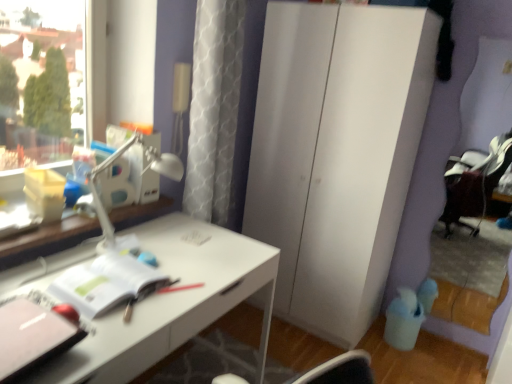
Question: Can you see pink matte notebook at lower left, marked as the 2th notebook in a back-to-front arrangement, touching white matte notebook at center, which is counted as the second notebook, starting from the front?

Choices:
 (A) no
 (B) yes

Answer: (A)

Question: Can you confirm if pink matte notebook at lower left, the 1th notebook in the front-to-back sequence, is positioned to the left of white matte notebook at center, the 1th notebook when ordered from back to front?

Choices:
 (A) no
 (B) yes

Answer: (B)

Question: Is the depth of pink matte notebook at lower left, marked as the 2th notebook in a back-to-front arrangement, greater than that of white matte notebook at center, the 1th notebook when ordered from back to front?

Choices:
 (A) yes
 (B) no

Answer: (B)

Question: Could you tell me if pink matte notebook at lower left, the 1th notebook in the front-to-back sequence, is turned towards white matte notebook at center, the 1th notebook when ordered from back to front?

Choices:
 (A) no
 (B) yes

Answer: (A)

Question: From a real-world perspective, is pink matte notebook at lower left, the 1th notebook in the front-to-back sequence, located beneath white matte notebook at center, the 1th notebook when ordered from back to front?

Choices:
 (A) no
 (B) yes

Answer: (A)

Question: Would you say white plastic table lamp at upper left is to the left or to the right of white matte notebook at center, which is counted as the second notebook, starting from the front, in the picture?

Choices:
 (A) right
 (B) left

Answer: (A)

Question: Is white plastic table lamp at upper left spatially inside white matte notebook at center, the 1th notebook when ordered from back to front, or outside of it?

Choices:
 (A) outside
 (B) inside

Answer: (A)

Question: Is white plastic table lamp at upper left in front of or behind white matte notebook at center, which is counted as the second notebook, starting from the front, in the image?

Choices:
 (A) behind
 (B) front

Answer: (A)

Question: Is point (151, 152) positioned closer to the camera than point (118, 266)?

Choices:
 (A) closer
 (B) farther

Answer: (B)

Question: From a real-world perspective, is white plastic table lamp at upper left positioned above or below white glossy desk at center?

Choices:
 (A) below
 (B) above

Answer: (B)

Question: Is white plastic table lamp at upper left inside or outside of white glossy desk at center?

Choices:
 (A) inside
 (B) outside

Answer: (B)

Question: In the image, is white plastic table lamp at upper left positioned in front of or behind white glossy desk at center?

Choices:
 (A) behind
 (B) front

Answer: (A)

Question: From the image's perspective, is white plastic table lamp at upper left located above or below white glossy desk at center?

Choices:
 (A) above
 (B) below

Answer: (A)

Question: Considering the positions of pink matte notebook at lower left, the 1th notebook in the front-to-back sequence, and white plastic table lamp at upper left in the image, is pink matte notebook at lower left, the 1th notebook in the front-to-back sequence, bigger or smaller than white plastic table lamp at upper left?

Choices:
 (A) small
 (B) big

Answer: (A)

Question: Is pink matte notebook at lower left, the 1th notebook in the front-to-back sequence, in front of or behind white plastic table lamp at upper left in the image?

Choices:
 (A) behind
 (B) front

Answer: (B)